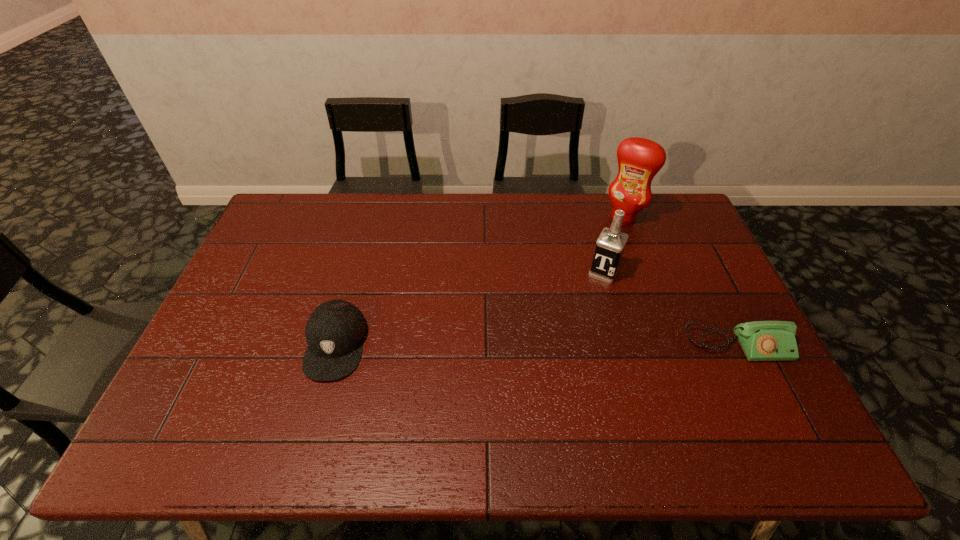
The width and height of the screenshot is (960, 540). In order to click on vacant space located on the front label of the second tallest object in this screenshot , I will do `click(586, 307)`.

Where is `free space located on the label side of the tallest object`? The image size is (960, 540). free space located on the label side of the tallest object is located at coordinates (576, 288).

Image resolution: width=960 pixels, height=540 pixels. Identify the location of vacant area situated on the label side of the tallest object. (581, 280).

Find the location of a particular element. vacant space located 0.310m on the label side of the tallest object is located at coordinates (x=580, y=282).

I want to click on object located at the far edge, so click(639, 159).

The height and width of the screenshot is (540, 960). Identify the location of object at the near edge. (335, 331).

You are a GUI agent. You are given a task and a screenshot of the screen. Output one action in this format:
    pyautogui.click(x=<x>, y=<y>)
    Task: Click on the object that is at the right edge
    The height and width of the screenshot is (540, 960).
    Given the screenshot: What is the action you would take?
    pyautogui.click(x=761, y=340)

Locate an element on the screen. free space at the far edge is located at coordinates (422, 231).

Identify the location of vacant area at the near edge of the desktop. Image resolution: width=960 pixels, height=540 pixels. (502, 411).

You are a GUI agent. You are given a task and a screenshot of the screen. Output one action in this format:
    pyautogui.click(x=<x>, y=<y>)
    Task: Click on the free point at the left edge
    This screenshot has width=960, height=540.
    Given the screenshot: What is the action you would take?
    pyautogui.click(x=253, y=274)